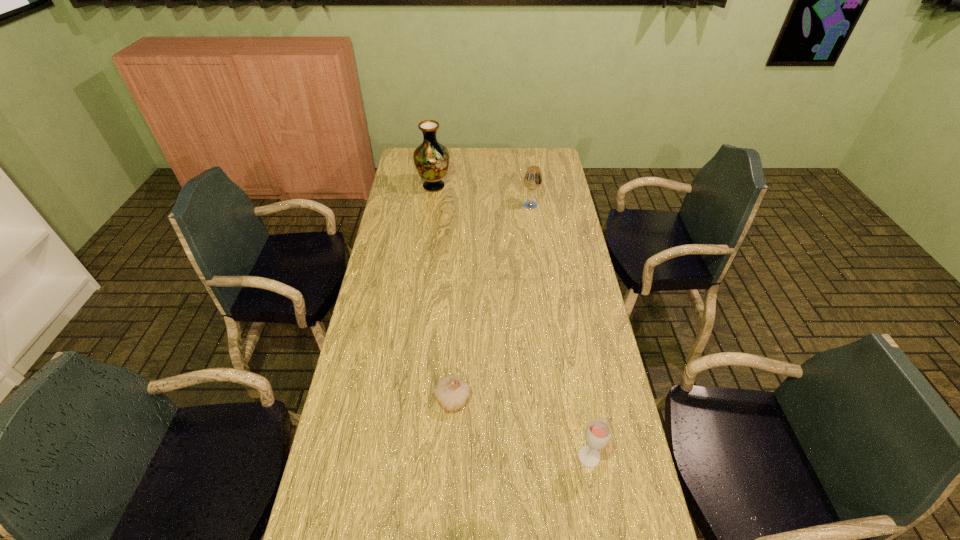
Locate an element on the screen. This screenshot has height=540, width=960. free point located 0.180m on the front of the garlic is located at coordinates (448, 482).

Identify the location of object that is at the left edge. (431, 159).

At what (x,y) coordinates should I click in order to perform the action: click on vacant space at the far edge of the desktop. Please return your answer as a coordinate pair (x, y). Looking at the image, I should click on (469, 170).

Locate an element on the screen. This screenshot has height=540, width=960. vacant point at the left edge is located at coordinates (400, 319).

I want to click on vacant area at the right edge, so click(564, 308).

Where is `blank space at the far left corner of the desktop`? blank space at the far left corner of the desktop is located at coordinates (412, 159).

Where is `vacant area that lies between the tallest object and the farther wineglass`? Image resolution: width=960 pixels, height=540 pixels. vacant area that lies between the tallest object and the farther wineglass is located at coordinates (482, 195).

Locate an element on the screen. The image size is (960, 540). free point between the tallest object and the third farthest object is located at coordinates (444, 293).

Find the location of a particular element. vacant space in between the third farthest object and the second shortest object is located at coordinates (520, 428).

Where is `unoccupied position between the tallest object and the nearer wineglass`? The width and height of the screenshot is (960, 540). unoccupied position between the tallest object and the nearer wineglass is located at coordinates (512, 322).